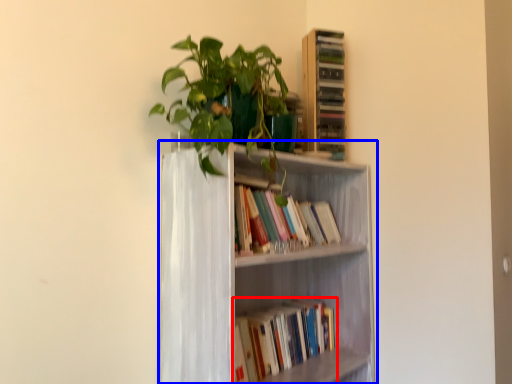
Question: Which object appears farthest to the camera in this image, book (highlighted by a red box) or bookcase (highlighted by a blue box)?

Choices:
 (A) book
 (B) bookcase

Answer: (A)